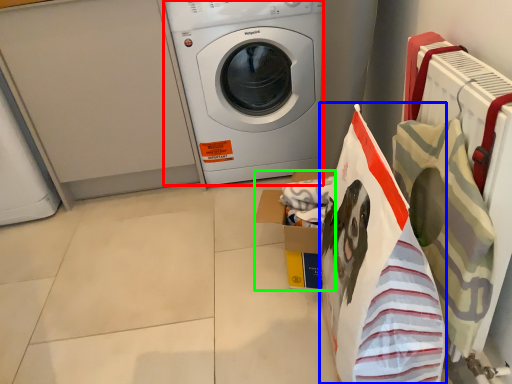
Question: Considering the real-world distances, which object is closest to washing machine (highlighted by a red box)? shopping bag (highlighted by a blue box) or cardboard box (highlighted by a green box).

Choices:
 (A) shopping bag
 (B) cardboard box

Answer: (B)